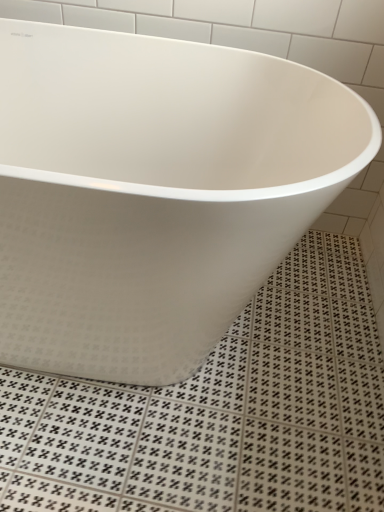
What do you see at coordinates (153, 192) in the screenshot? I see `white glossy bathtub at center` at bounding box center [153, 192].

This screenshot has height=512, width=384. I want to click on white glossy bathtub at center, so click(x=153, y=192).

This screenshot has width=384, height=512. In order to click on white glossy bathtub at center in this screenshot , I will do `click(153, 192)`.